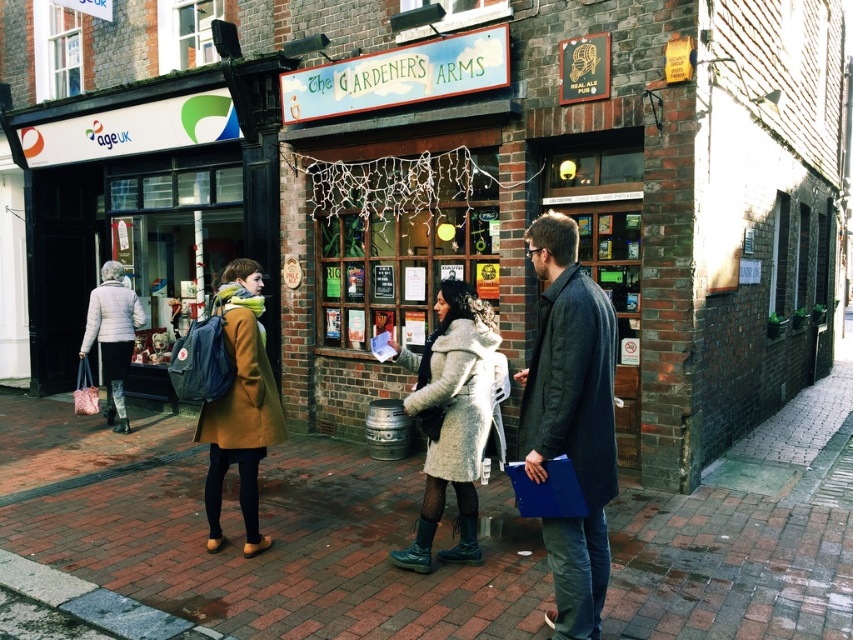
You are standing in front of the shop named The Gardener Arms. There is a point at coordinates [572,419]. What is located at that point?

At point [572,419] lies a fluffy beige coat at center.